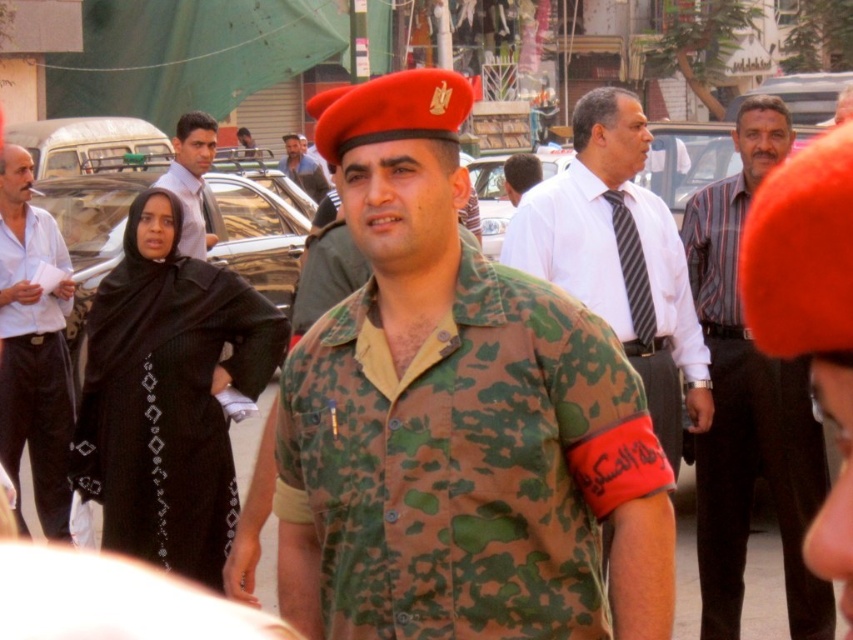
Question: Which of these objects is positioned farthest from the white shirt with tie at center?

Choices:
 (A) matte black shirt at left
 (B) matte black shirt at center
 (C) black matte dress at left
 (D) striped cotton shirt at center

Answer: (B)

Question: Which object appears closest to the camera in this image?

Choices:
 (A) camouflage fabric shirt at center
 (B) matte black shirt at center
 (C) striped fabric tie at center

Answer: (A)

Question: Does matte white shirt at upper left have a greater width compared to striped fabric tie at center?

Choices:
 (A) no
 (B) yes

Answer: (B)

Question: Among these points, which one is nearest to the camera?

Choices:
 (A) (16, 516)
 (B) (666, 412)

Answer: (B)

Question: From the image, what is the correct spatial relationship of striped fabric tie at center in relation to matte black shirt at center?

Choices:
 (A) right
 (B) left

Answer: (A)

Question: Does black matte dress at left lie in front of matte white shirt at upper left?

Choices:
 (A) yes
 (B) no

Answer: (A)